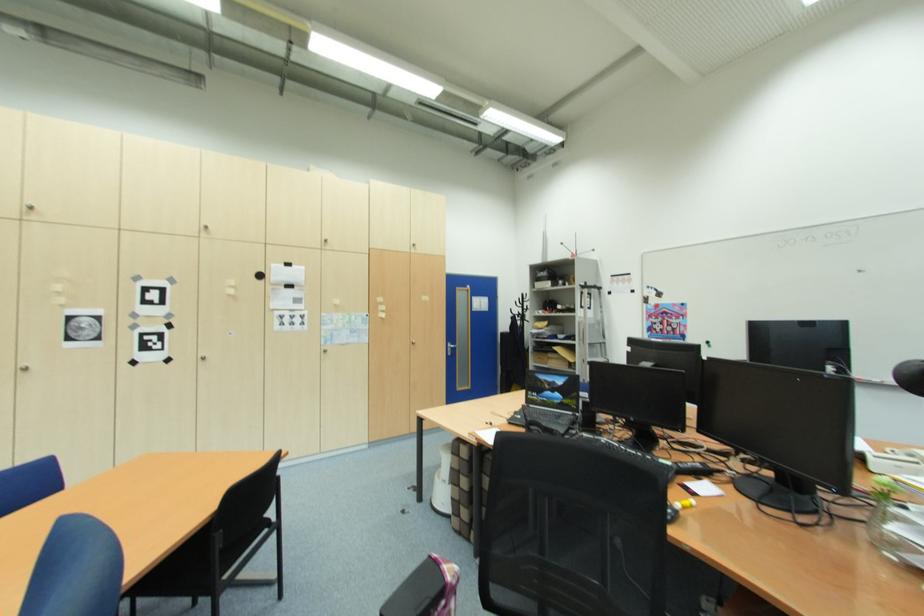
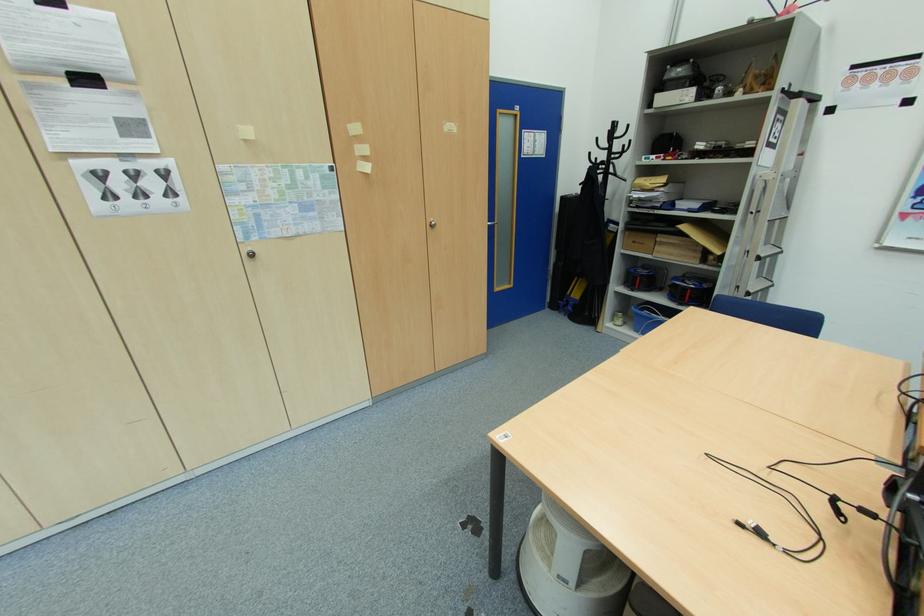
Locate, in the second image, the point that corresponds to the point at 552,353 in the first image.

(660, 233)